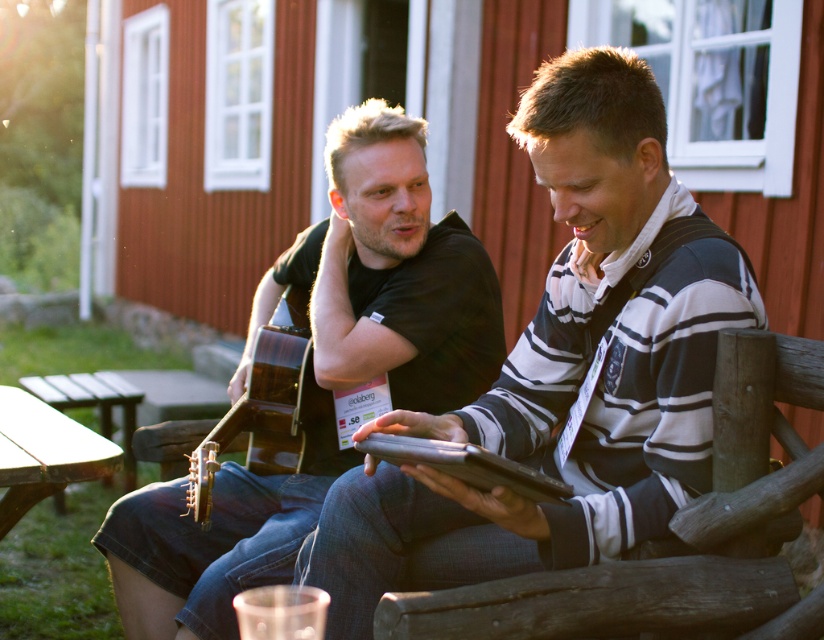
Question: Which object appears closest to the camera in this image?

Choices:
 (A) wooden acoustic guitar at center
 (B) black matte guitar at left

Answer: (B)

Question: Is black matte guitar at left wider than wooden picnic table at lower left?

Choices:
 (A) no
 (B) yes

Answer: (B)

Question: Observing the image, what is the correct spatial positioning of striped cotton sweater at center in reference to wooden picnic table at lower left?

Choices:
 (A) below
 (B) above

Answer: (B)

Question: Which object is positioned farthest from the striped cotton sweater at center?

Choices:
 (A) wooden picnic table at lower left
 (B) black matte guitar at left

Answer: (A)

Question: Which of the following is the farthest from the observer?

Choices:
 (A) wooden acoustic guitar at center
 (B) black matte guitar at left

Answer: (A)

Question: Is the position of striped cotton sweater at center less distant than that of black matte guitar at left?

Choices:
 (A) yes
 (B) no

Answer: (A)